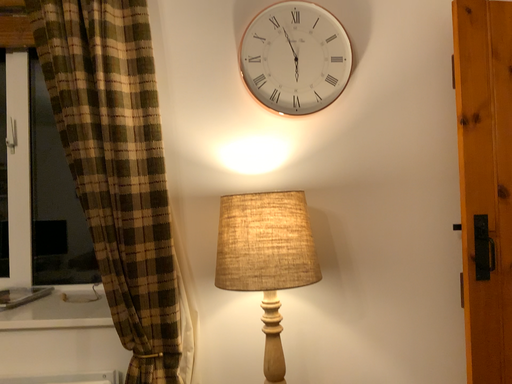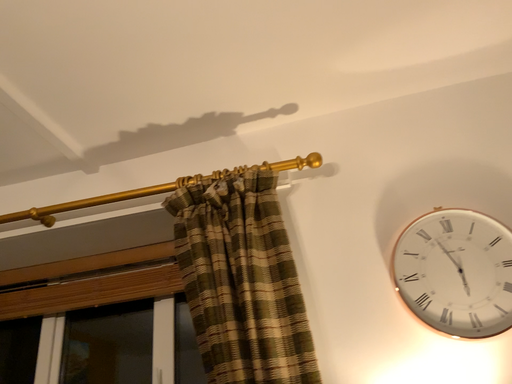
Question: Which way did the camera rotate in the video?

Choices:
 (A) rotated right
 (B) rotated left

Answer: (B)